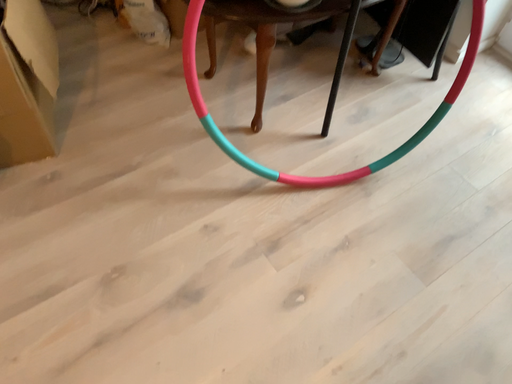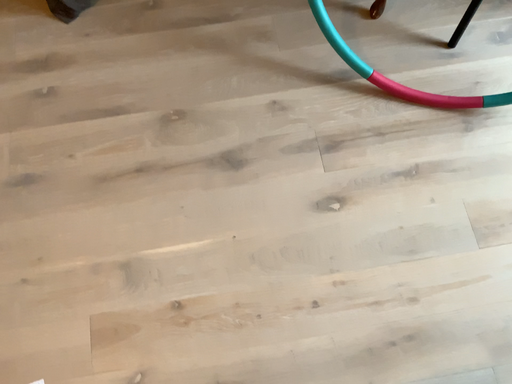
Question: Which way did the camera rotate in the video?

Choices:
 (A) rotated left
 (B) rotated right

Answer: (A)